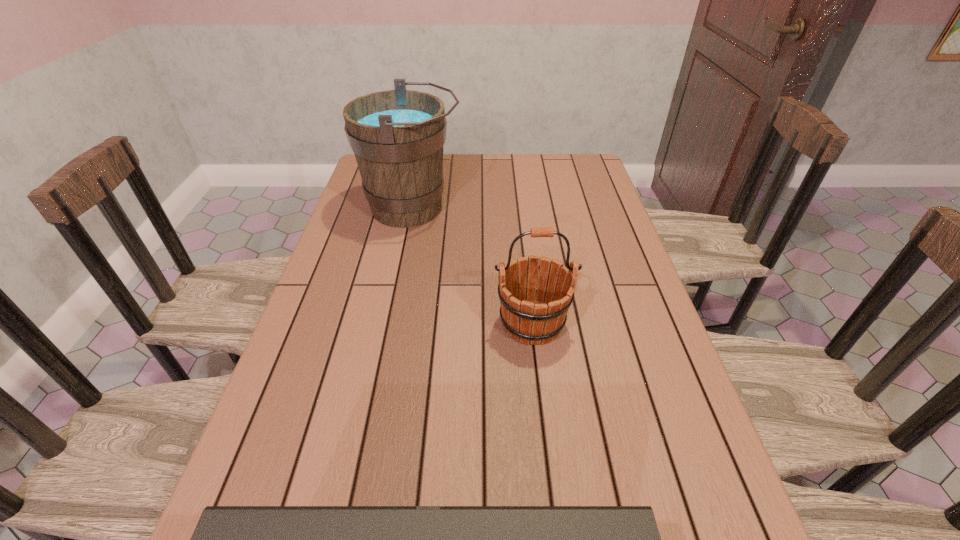
Where is `the farther wine bucket`? This screenshot has width=960, height=540. the farther wine bucket is located at coordinates (397, 136).

At what (x,y) coordinates should I click in order to perform the action: click on the tallest object. Please return your answer as a coordinate pair (x, y). Looking at the image, I should click on (397, 136).

Image resolution: width=960 pixels, height=540 pixels. What are the coordinates of `the second farthest object` in the screenshot? It's located at (529, 321).

Where is `the right wine bucket`? Image resolution: width=960 pixels, height=540 pixels. the right wine bucket is located at coordinates (529, 321).

In order to click on vacant region located 0.300m with a handle on the side of the tallest object in this screenshot , I will do `click(555, 208)`.

In order to click on vacant area located 0.400m on the back of the nearer wine bucket in this screenshot , I will do `click(518, 211)`.

Find the location of `object at the far edge`. object at the far edge is located at coordinates (397, 136).

You are a GUI agent. You are given a task and a screenshot of the screen. Output one action in this format:
    pyautogui.click(x=<x>, y=<y>)
    Task: Click on the object positioned at the left edge
    The height and width of the screenshot is (540, 960).
    Given the screenshot: What is the action you would take?
    pyautogui.click(x=397, y=136)

Locate an element on the screen. The width and height of the screenshot is (960, 540). object present at the far left corner is located at coordinates (397, 136).

At what (x,y) coordinates should I click in order to perform the action: click on vacant area at the far edge. Please return your answer as a coordinate pair (x, y). The image size is (960, 540). Looking at the image, I should click on (555, 185).